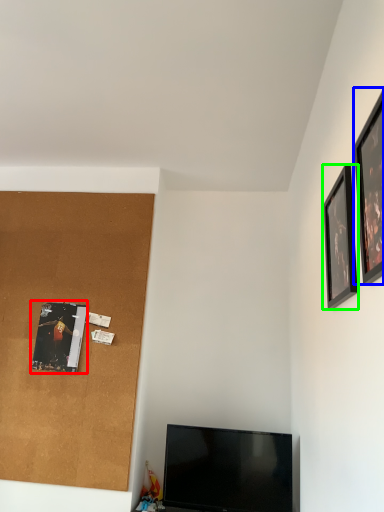
Question: Estimate the real-world distances between objects in this image. Which object is farther from picture frame (highlighted by a red box), picture frame (highlighted by a blue box) or picture frame (highlighted by a green box)?

Choices:
 (A) picture frame
 (B) picture frame

Answer: (A)